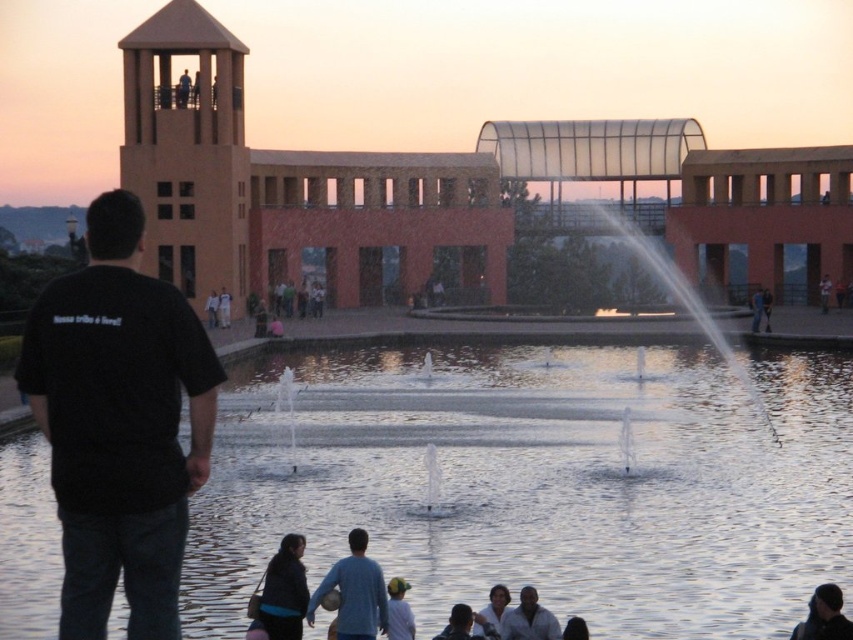
Does blue cotton shirt at lower center appear on the left side of smooth black shirt at lower center?

Correct, you'll find blue cotton shirt at lower center to the left of smooth black shirt at lower center.

Can you confirm if blue cotton shirt at lower center is positioned above smooth black shirt at lower center?

Yes, blue cotton shirt at lower center is above smooth black shirt at lower center.

Locate an element on the screen. blue cotton shirt at lower center is located at coordinates (354, 593).

Can you confirm if black cotton t-shirt at left is thinner than smooth black shirt at lower center?

In fact, black cotton t-shirt at left might be wider than smooth black shirt at lower center.

Is point (115, 204) positioned after point (491, 605)?

No.

Identify the location of black cotton t-shirt at left. (119, 424).

Is clear water at center thinner than smooth black shirt at lower center?

No.

Between point (590, 528) and point (491, 621), which one is positioned behind?

The point (590, 528) is behind.

Image resolution: width=853 pixels, height=640 pixels. What do you see at coordinates (538, 483) in the screenshot?
I see `clear water at center` at bounding box center [538, 483].

Locate an element on the screen. The width and height of the screenshot is (853, 640). clear water at center is located at coordinates (538, 483).